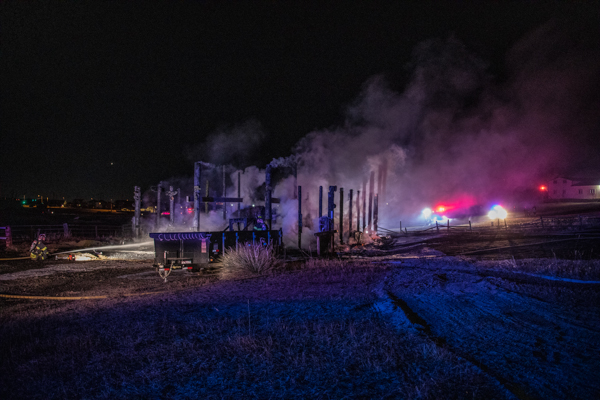
This screenshot has height=400, width=600. I want to click on white light, so click(x=597, y=189).